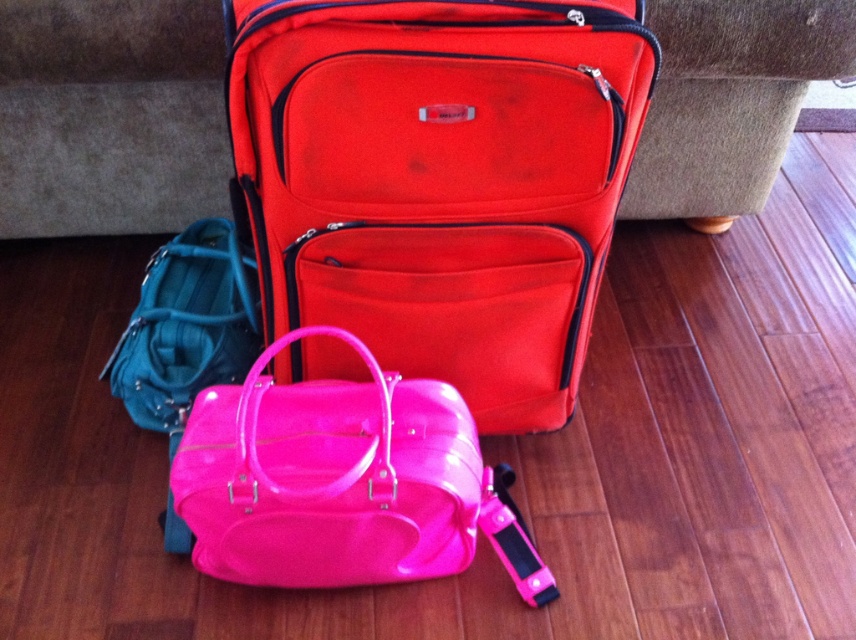
Question: Among these objects, which one is farthest from the camera?

Choices:
 (A) matte red suitcase at center
 (B) glossy teal handbag at lower left
 (C) suede-like brown couch at upper center

Answer: (B)

Question: From the image, what is the correct spatial relationship of glossy vinyl duffel at center in relation to glossy teal handbag at lower left?

Choices:
 (A) right
 (B) left

Answer: (A)

Question: Does matte red suitcase at center appear under glossy vinyl duffel at center?

Choices:
 (A) yes
 (B) no

Answer: (B)

Question: Which point appears closest to the camera in this image?

Choices:
 (A) (418, 291)
 (B) (134, 324)
 (C) (186, 515)

Answer: (C)

Question: In this image, where is suede-like brown couch at upper center located relative to glossy teal handbag at lower left?

Choices:
 (A) above
 (B) below

Answer: (A)

Question: Estimate the real-world distances between objects in this image. Which object is farther from the glossy teal handbag at lower left?

Choices:
 (A) matte red suitcase at center
 (B) glossy vinyl duffel at center
 (C) suede-like brown couch at upper center

Answer: (A)